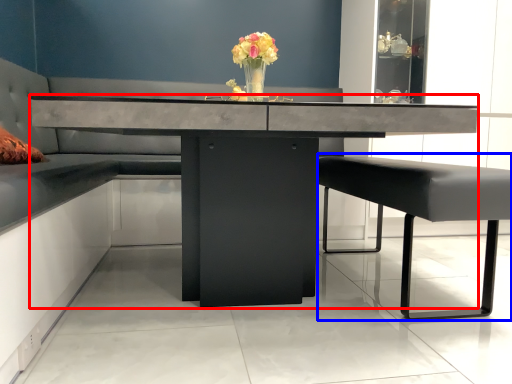
Question: Which of the following is the farthest to the observer, table (highlighted by a red box) or swivel chair (highlighted by a blue box)?

Choices:
 (A) table
 (B) swivel chair

Answer: (B)